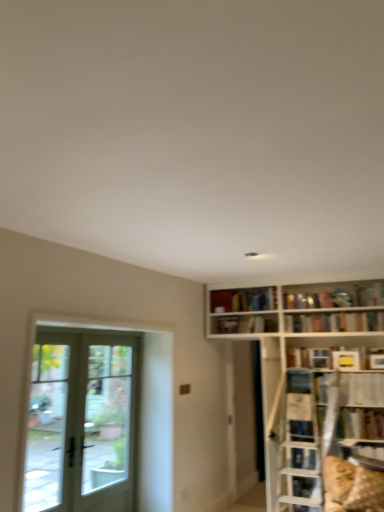
Question: Can you confirm if yellow matte bookshelf at upper right, which appears as the fourth book when viewed from the top, is bigger than white plastic shelf at upper right?

Choices:
 (A) no
 (B) yes

Answer: (A)

Question: Considering the relative sizes of yellow matte bookshelf at upper right, which appears as the fourth book when viewed from the top, and white plastic shelf at upper right in the image provided, is yellow matte bookshelf at upper right, which appears as the fourth book when viewed from the top, taller than white plastic shelf at upper right?

Choices:
 (A) no
 (B) yes

Answer: (A)

Question: From the image's perspective, is yellow matte bookshelf at upper right, positioned as the second book in bottom-to-top order, beneath white plastic shelf at upper right?

Choices:
 (A) no
 (B) yes

Answer: (A)

Question: Is yellow matte bookshelf at upper right, which appears as the fourth book when viewed from the top, at the right side of white plastic shelf at upper right?

Choices:
 (A) no
 (B) yes

Answer: (A)

Question: Is yellow matte bookshelf at upper right, placed as the fourth book when sorted from left to right, aimed at white plastic shelf at upper right?

Choices:
 (A) yes
 (B) no

Answer: (B)

Question: From the image's perspective, is yellow matte bookshelf at upper right, which appears as the fourth book when viewed from the top, on top of white plastic shelf at upper right?

Choices:
 (A) yes
 (B) no

Answer: (A)

Question: Considering the relative sizes of white matte bookshelf at upper center, the fifth book when ordered from right to left, and white glass door at left in the image provided, is white matte bookshelf at upper center, the fifth book when ordered from right to left, wider than white glass door at left?

Choices:
 (A) yes
 (B) no

Answer: (B)

Question: Is white matte bookshelf at upper center, which ranks as the first book in left-to-right order, further to the viewer compared to white glass door at left?

Choices:
 (A) no
 (B) yes

Answer: (B)

Question: Is white matte bookshelf at upper center, marked as the 3th book in a bottom-to-top arrangement, with white glass door at left?

Choices:
 (A) no
 (B) yes

Answer: (A)

Question: Is white matte bookshelf at upper center, which ranks as the first book in left-to-right order, aimed at white glass door at left?

Choices:
 (A) no
 (B) yes

Answer: (A)

Question: Does white matte bookshelf at upper center, which ranks as the first book in left-to-right order, have a lesser height compared to white glass door at left?

Choices:
 (A) yes
 (B) no

Answer: (A)

Question: From a real-world perspective, is white matte bookshelf at upper center, marked as the 3th book in a bottom-to-top arrangement, physically below white glass door at left?

Choices:
 (A) no
 (B) yes

Answer: (A)

Question: Considering the relative sizes of white plastic shelf at upper right and yellow matte bookshelf at upper right, positioned as the second book in bottom-to-top order, in the image provided, is white plastic shelf at upper right thinner than yellow matte bookshelf at upper right, positioned as the second book in bottom-to-top order,?

Choices:
 (A) no
 (B) yes

Answer: (A)